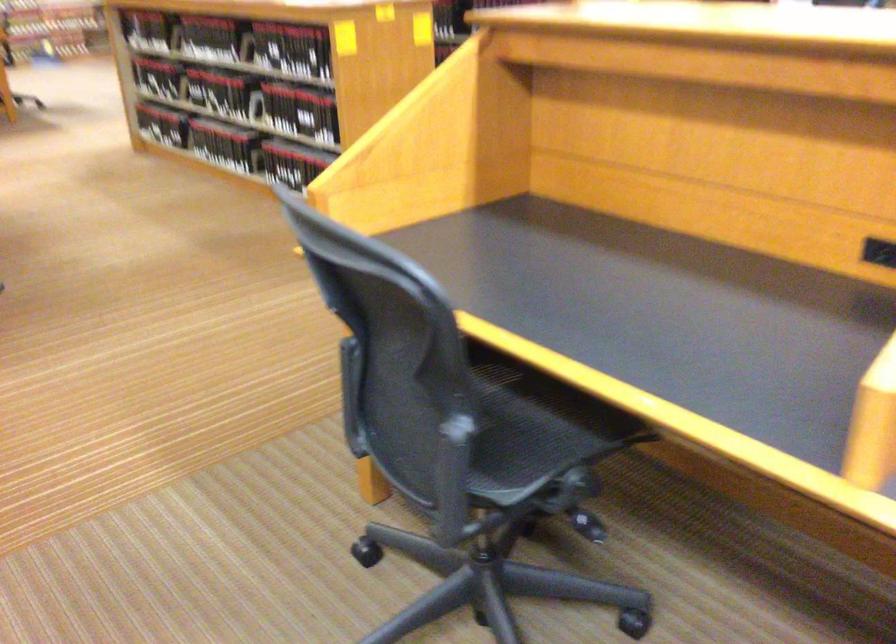
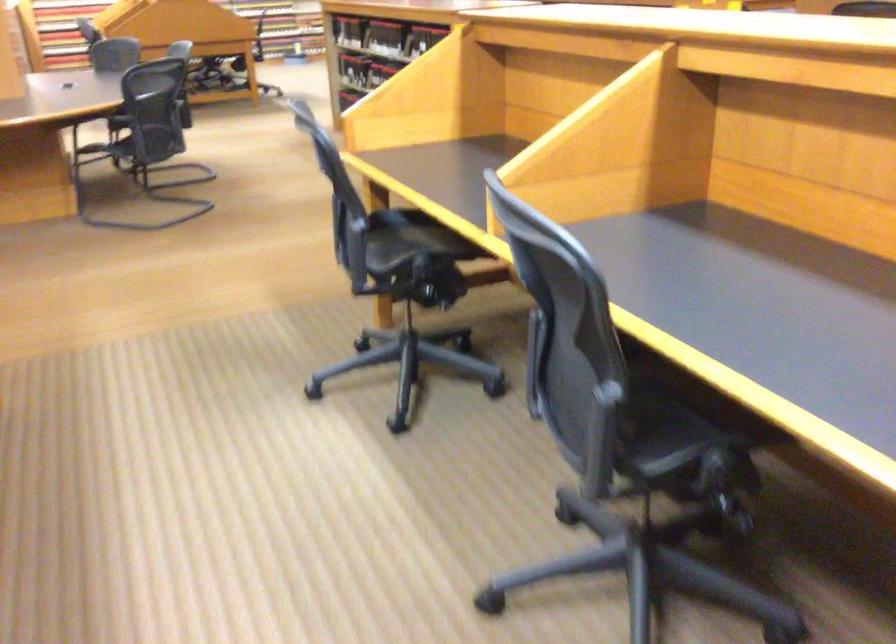
Locate, in the second image, the point that corresponds to (x=481, y=404) in the first image.

(409, 240)